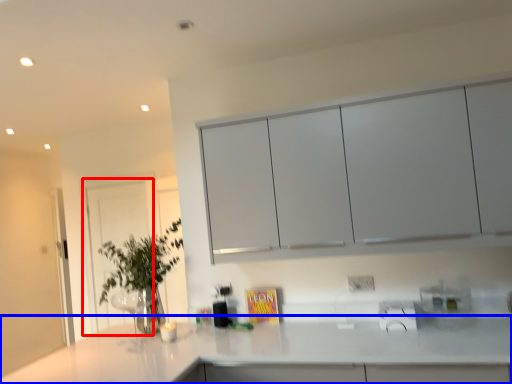
Question: Which of the following is the closest to the observer, glass door (highlighted by a red box) or countertop (highlighted by a blue box)?

Choices:
 (A) glass door
 (B) countertop

Answer: (B)